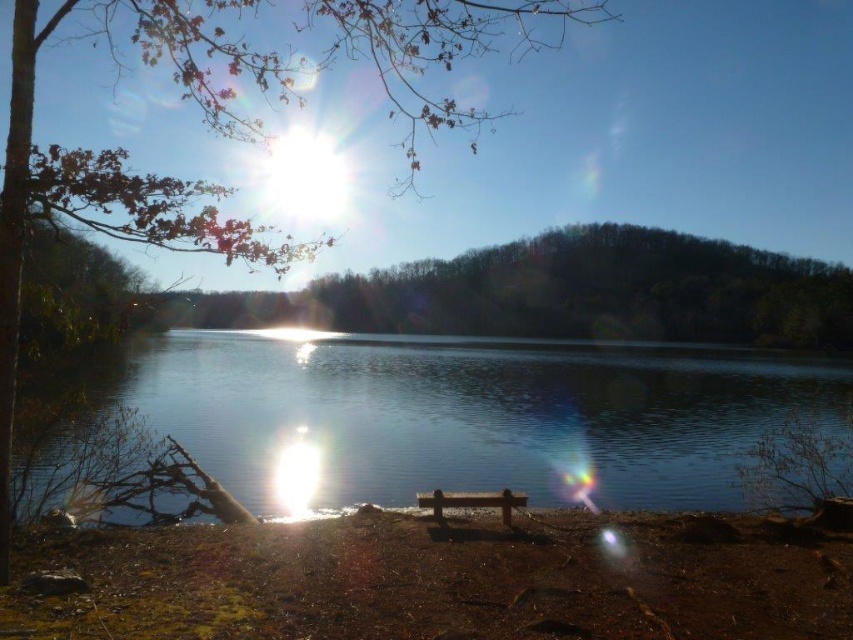
Question: Which object is the farthest from the brown wooden bench at lower center?

Choices:
 (A) green leafy tree at center
 (B) brown dirt at lower center
 (C) brown leafy tree at upper left
 (D) clear water at center

Answer: (A)

Question: Is brown dirt at lower center behind brown wooden bench at lower center?

Choices:
 (A) yes
 (B) no

Answer: (B)

Question: Which is nearer to the green leafy tree at center?

Choices:
 (A) clear water at center
 (B) brown dirt at lower center
 (C) brown wooden bench at lower center

Answer: (A)

Question: Among these objects, which one is farthest from the camera?

Choices:
 (A) brown wooden bench at lower center
 (B) green leafy tree at center
 (C) brown leafy tree at upper left

Answer: (A)

Question: Is green leafy tree at center smaller than brown wooden bench at lower center?

Choices:
 (A) yes
 (B) no

Answer: (B)

Question: Is clear water at center closer to the viewer compared to brown wooden bench at lower center?

Choices:
 (A) yes
 (B) no

Answer: (B)